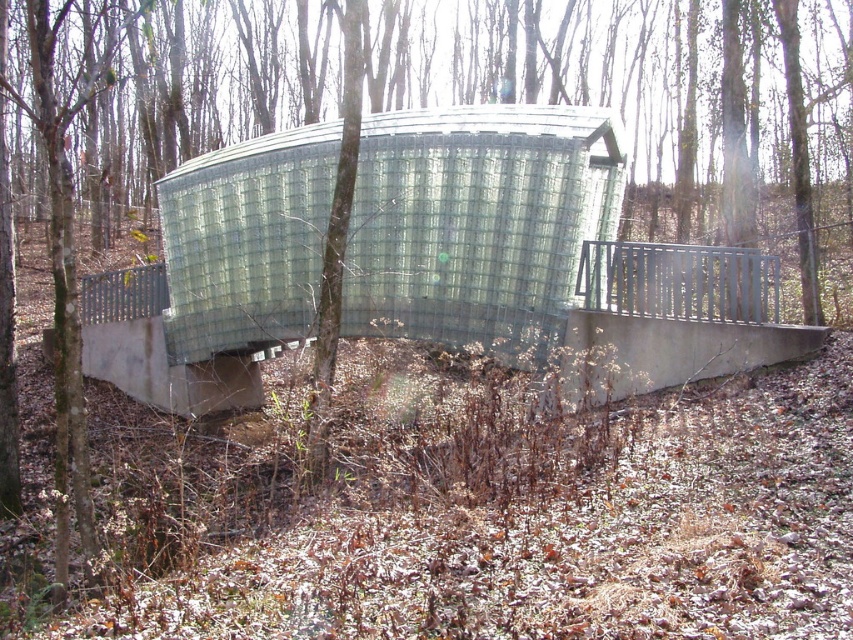
You are a maintenance worker inspecting the clear glass shelter at center and the metallic gray rail at center. Your supervisor asks if the shelter extends higher than the rail. How do you respond?

The clear glass shelter at center is taller than the metallic gray rail at center, so yes, the shelter does extend higher than the rail.

You are standing in the wooded area and want to enter the clear glass shelter at center. To do so, you must walk around the metallic gray rail at center. Which direction should you walk relative to the rail to reach the shelter?

The clear glass shelter at center is to the left of the metallic gray rail at center, so you should walk to the left of the rail to reach the shelter.

You are standing at the camera position looking at the curved glass shelter. There is a specific point marked at coordinates point (285,193). Can you estimate how far this point is from your current position?

The point (285,193) is 51.12 feet away from the camera position.